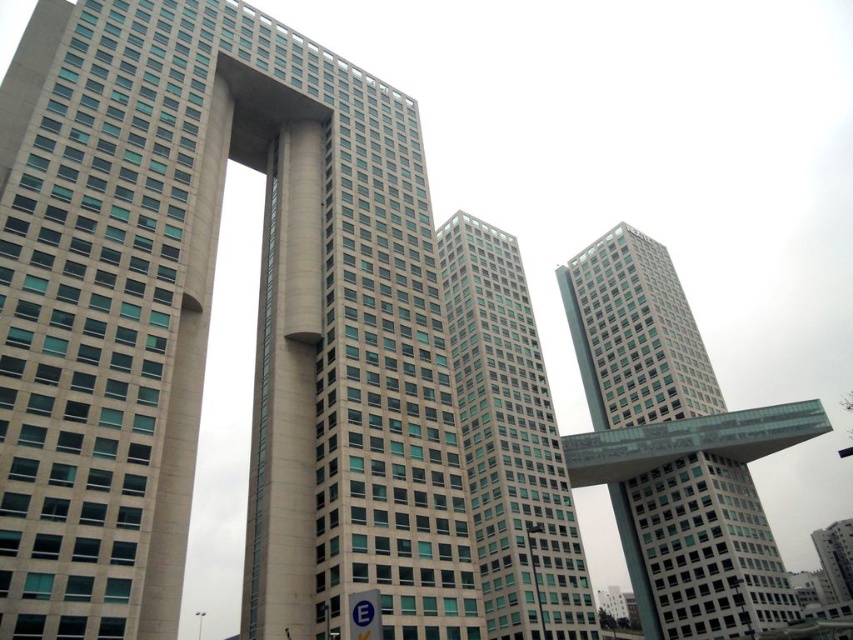
Measure the distance between white glass tower at center and camera.

76.07 meters

Who is taller, white glass tower at center or glassy teal skyscraper at center?

white glass tower at center is taller.

Does point (641, 440) come behind point (483, 538)?

Yes, point (641, 440) is behind point (483, 538).

The width and height of the screenshot is (853, 640). I want to click on white glass tower at center, so click(674, 449).

Does point (184, 237) come closer to viewer compared to point (631, 528)?

That is True.

Which is below, beige concrete building at center or white glass tower at center?

Positioned lower is white glass tower at center.

Image resolution: width=853 pixels, height=640 pixels. I want to click on beige concrete building at center, so click(x=207, y=326).

Which is behind, point (329, 476) or point (512, 524)?

The point (512, 524) is more distant.

Locate an element on the screen. The height and width of the screenshot is (640, 853). beige concrete building at center is located at coordinates (207, 326).

Does point (351, 214) lie in front of point (523, 291)?

Yes, it is in front of point (523, 291).

The height and width of the screenshot is (640, 853). I want to click on beige concrete building at center, so click(x=207, y=326).